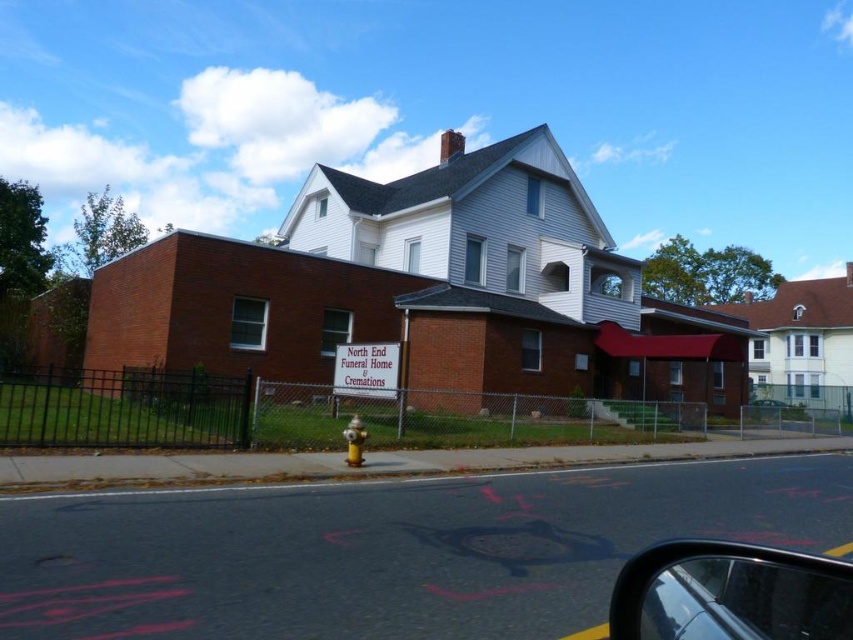
You are a delivery driver who needs to park your truck near the North End Funeral Home. The truck requires a parking spot with enough clearance for its height. The truck is 2 meters tall. Can the white plastic sign at center and the yellow metallic hydrant at lower center be obstacles in this parking area? Please explain based on their heights.

The white plastic sign at center has a greater height compared to the yellow metallic hydrant at lower center. However, since the exact heights are not provided, it is impossible to determine if either object poses a height clearance issue for the 2 meter tall truck. Additional information about their specific heights is needed to make an accurate assessment.

You are standing in front of the North End Funeral Home and want to take a photo of the building. You notice two points marked on your camera screen at coordinates point (381, 378) and point (347, 444). Which point is closer to your camera lens?

Point (347, 444) is closer to the camera lens because it is less further away than point (381, 378).